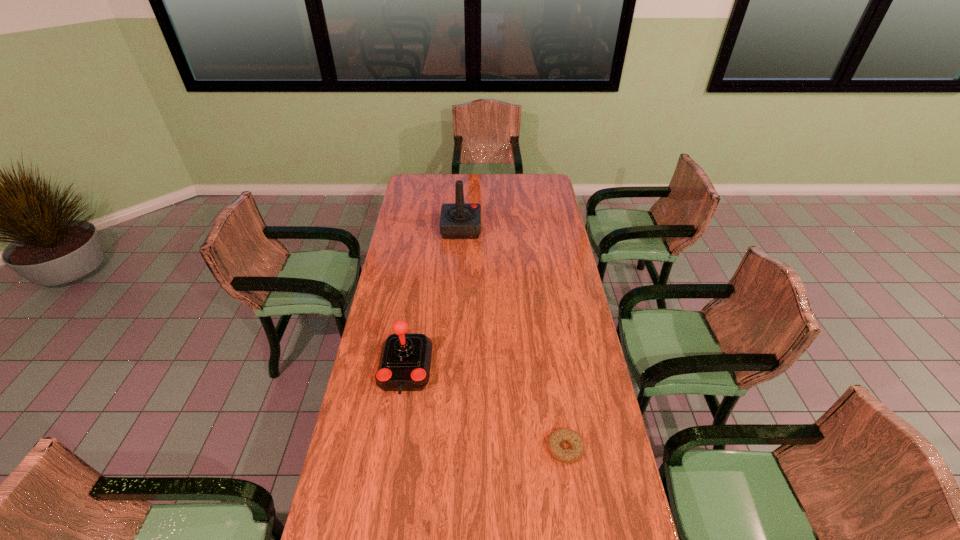
Image resolution: width=960 pixels, height=540 pixels. What are the coordinates of `free space that is in between the second shortest object and the taller joystick` in the screenshot? It's located at (433, 299).

I want to click on object that stands as the second closest to the bagel, so click(459, 220).

This screenshot has width=960, height=540. I want to click on object that is the closest one to the second shortest object, so click(558, 436).

At what (x,y) coordinates should I click in order to perform the action: click on joystick that is the second closest one to the shortest object. Please return your answer as a coordinate pair (x, y). This screenshot has height=540, width=960. Looking at the image, I should click on (459, 220).

This screenshot has width=960, height=540. What are the coordinates of `free spot that satisfies the following two spatial constraints: 1. on the front-facing side of the bagel; 2. on the left side of the taller joystick` in the screenshot? It's located at (449, 448).

Where is `vacant region that satisfies the following two spatial constraints: 1. on the front-facing side of the shortest object; 2. on the right side of the farthest object`? Image resolution: width=960 pixels, height=540 pixels. vacant region that satisfies the following two spatial constraints: 1. on the front-facing side of the shortest object; 2. on the right side of the farthest object is located at coordinates (449, 448).

The height and width of the screenshot is (540, 960). I want to click on free space that satisfies the following two spatial constraints: 1. on the front-facing side of the tallest object; 2. on the base of the shorter joystick, so (x=454, y=369).

Find the location of a particular element. This screenshot has width=960, height=540. free space that satisfies the following two spatial constraints: 1. on the front-facing side of the farther joystick; 2. on the base of the nearer joystick is located at coordinates (454, 369).

The width and height of the screenshot is (960, 540). Identify the location of free spot that satisfies the following two spatial constraints: 1. on the front-facing side of the taller joystick; 2. on the back side of the shortest object. (449, 448).

At what (x,y) coordinates should I click in order to perform the action: click on vacant space that satisfies the following two spatial constraints: 1. on the front-facing side of the tallest object; 2. on the base of the shorter joystick. Please return your answer as a coordinate pair (x, y). This screenshot has height=540, width=960. Looking at the image, I should click on (454, 369).